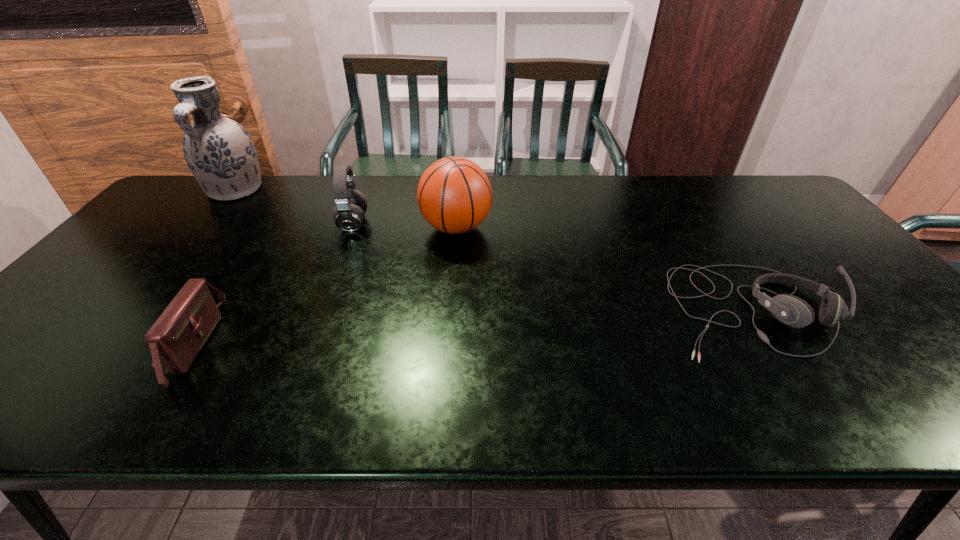
Identify the location of vacant region located 0.390m with the handle on the side of the leftmost object. (152, 292).

I want to click on vacant position located 0.120m on the front of the second object from right to left, so click(453, 276).

Locate an element on the screen. This screenshot has height=540, width=960. vacant region located on the ear cups of the left headset is located at coordinates (396, 224).

What are the coordinates of `free space located on the front flap of the fourth object from right to left` in the screenshot? It's located at (246, 344).

This screenshot has width=960, height=540. In order to click on vase that is positioned at the far edge in this screenshot , I will do `click(219, 152)`.

Find the location of a particular element. The image size is (960, 540). basketball that is at the far edge is located at coordinates (454, 194).

You are a GUI agent. You are given a task and a screenshot of the screen. Output one action in this format:
    pyautogui.click(x=<x>, y=<y>)
    Task: Click on the headset located at the far edge
    
    Given the screenshot: What is the action you would take?
    pyautogui.click(x=349, y=214)

Identify the location of object at the near edge. (175, 339).

At what (x,y) coordinates should I click in order to perform the action: click on object present at the left edge. Please return your answer as a coordinate pair (x, y). Looking at the image, I should click on tap(219, 152).

You are a GUI agent. You are given a task and a screenshot of the screen. Output one action in this format:
    pyautogui.click(x=<x>, y=<y>)
    Task: Click on the object situated at the far left corner
    
    Given the screenshot: What is the action you would take?
    pyautogui.click(x=219, y=152)